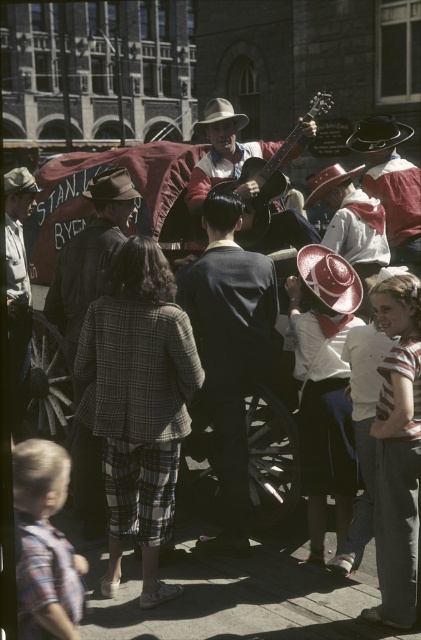
You are a photographer trying to capture the man in the dark blue suit at center and the red felt cowboy hat at center in a single shot. Since you want to ensure both are fully visible, which object should you focus on to account for their sizes?

The dark blue suit at center is taller than the red felt cowboy hat at center, so focusing on the dark blue suit at center ensures the entire height of both objects can be captured in the frame.

You are a photographer positioned at the edge of the lively street scene. You want to take a photo of the dark blue suit at center and the red felt cowboy hat at center. Which object should you focus on first to ensure both are in sharp focus?

The dark blue suit at center is closer to the viewer than the red felt cowboy hat at center, so you should focus on the dark blue suit at center first to ensure both are in sharp focus.